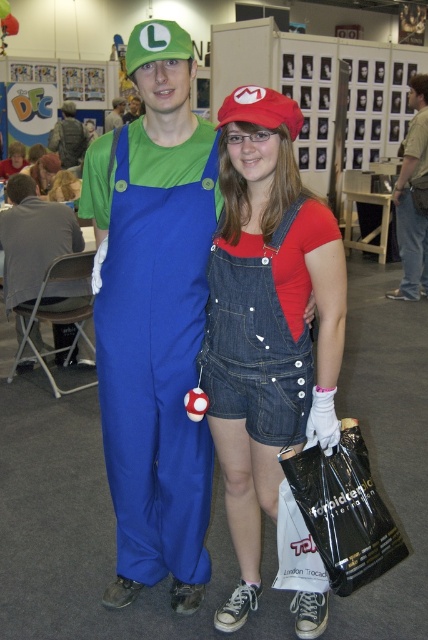
Question: Which point appears farthest from the camera in this image?

Choices:
 (A) (116, 100)
 (B) (128, 118)
 (C) (401, 182)
 (D) (335, 272)

Answer: (B)

Question: Does blue cotton overalls at center appear on the left side of denim shorts at center?

Choices:
 (A) yes
 (B) no

Answer: (B)

Question: Which point is farther to the camera?

Choices:
 (A) matte blue overalls at center
 (B) denim shorts at center
 (C) gray fabric pants at right
 (D) matte green fabric luigi hat at upper center

Answer: (D)

Question: Is denim shorts at center positioned at the back of matte green fabric luigi hat at upper center?

Choices:
 (A) no
 (B) yes

Answer: (A)

Question: Can you confirm if denim shorts at center is positioned below matte blue overalls at center?

Choices:
 (A) no
 (B) yes

Answer: (B)

Question: Which is farther from the gray fabric pants at right?

Choices:
 (A) blue cotton overalls at center
 (B) matte green fabric luigi hat at upper center
 (C) brushed metal water at bottle left
 (D) denim overalls at center

Answer: (B)